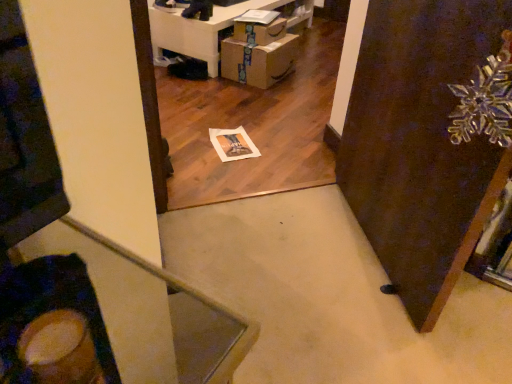
I want to click on free space in front of cardboard box at center, so click(258, 95).